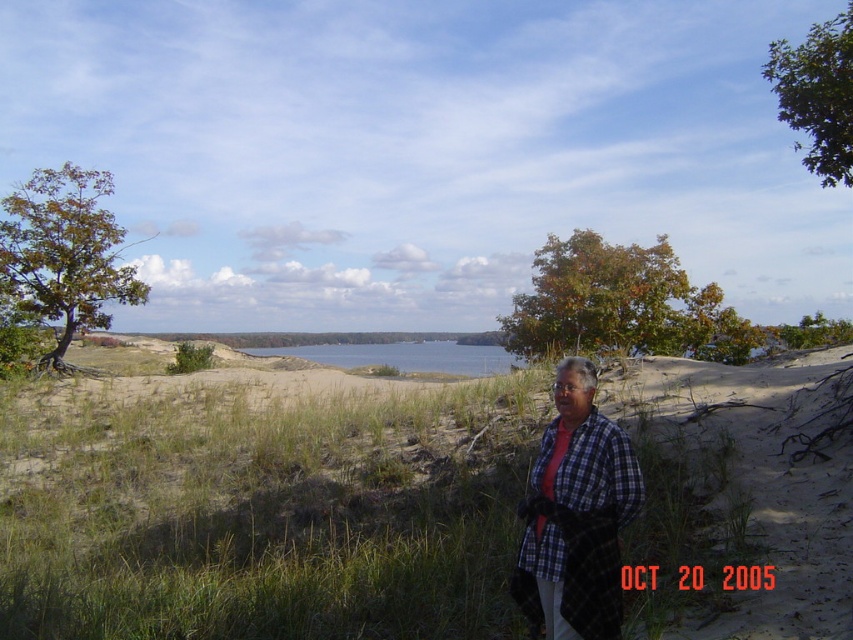
Question: Which object appears farthest from the camera in this image?

Choices:
 (A) green leafy tree at upper left
 (B) plaid fabric shirt at center
 (C) green grass at lower center

Answer: (A)

Question: Is green leafy tree at upper center positioned in front of blue water at center?

Choices:
 (A) no
 (B) yes

Answer: (B)

Question: Is green grass at lower center to the left of green leafy tree at upper center from the viewer's perspective?

Choices:
 (A) yes
 (B) no

Answer: (A)

Question: Which is nearer to the blue water at center?

Choices:
 (A) green grass at lower center
 (B) green leafy tree at upper left
 (C) green leafy tree at upper center

Answer: (C)

Question: Can you confirm if green grass at lower center is positioned to the left of green leafy tree at upper right?

Choices:
 (A) yes
 (B) no

Answer: (A)

Question: Which object is closer to the camera taking this photo?

Choices:
 (A) plaid fabric shirt at center
 (B) green grass at lower center
 (C) green leafy tree at upper center
 (D) green leafy tree at upper right

Answer: (A)